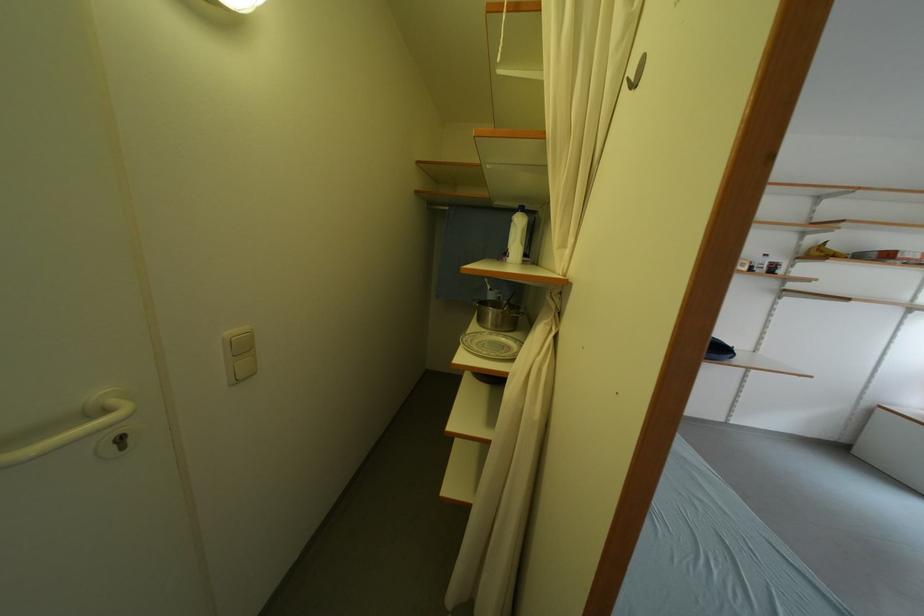
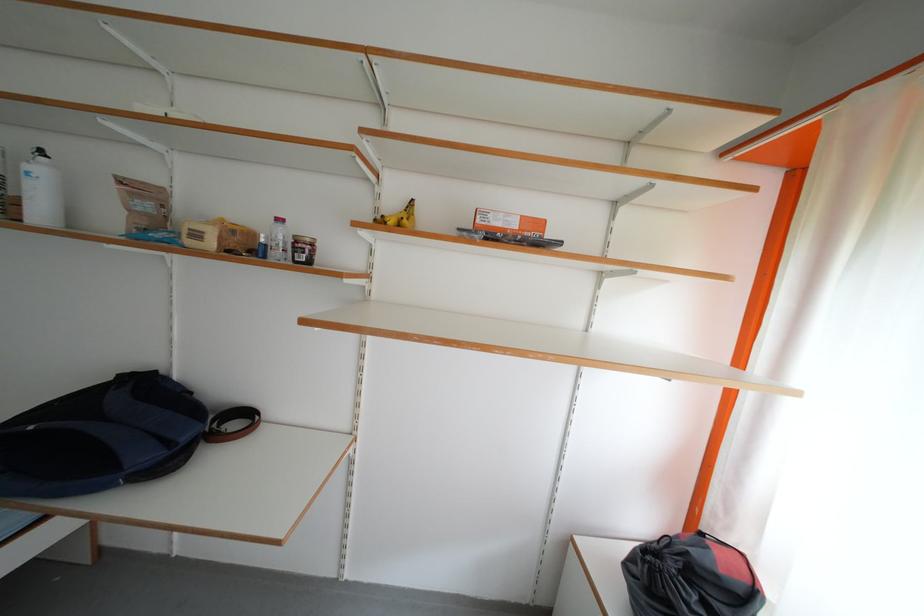
The images are taken continuously from a first-person perspective. In which direction are you moving?

Result: The cameraman walked toward right, forward.